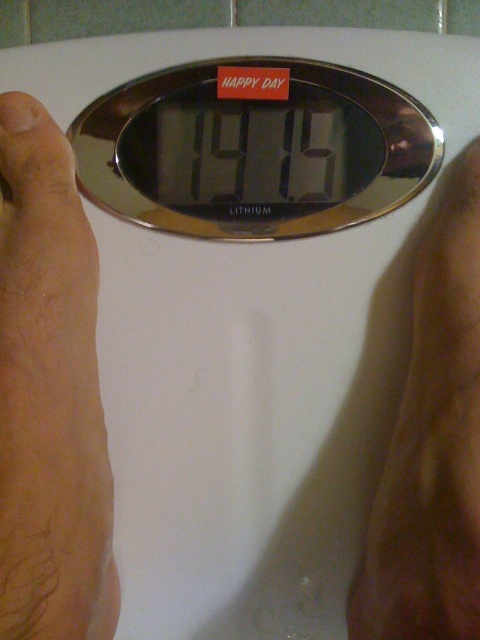
You are a physical therapist observing a patient using a scale. The patient has two hands on the scale, one labeled as the skinny flesh at left and the other as the brown leather hand at lower right. Which hand is positioned higher on the scale?

The skinny flesh at left is taller than the brown leather hand at lower right, so the skinny flesh at left is positioned higher on the scale.

You are a physical therapist analyzing the posture of the person in the image. Based on the position of the point at coordinates (49,396), which is labeled as skinny flesh at left, can you determine if the person is leaning more on their left hand compared to their right hand?

The point at coordinates (49,396) indicates skinny flesh at left, suggesting the person is leaning more on their left hand compared to their right hand.

You are standing in front of the digital scale and want to place a small sticker between the two points labeled point [6,106] and point [439,572]. Based on their positions, which point should the sticker be closer to?

The sticker should be placed closer to point [439,572] because point [6,106] is behind it.